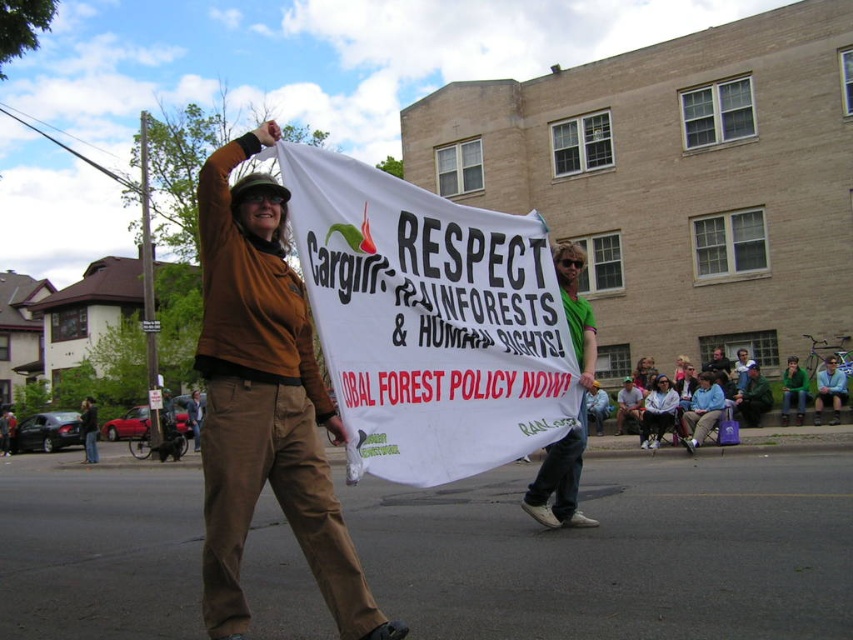
Can you confirm if white paper banner at center is positioned below green fabric shirt at center?

No, white paper banner at center is not below green fabric shirt at center.

Which of these two, white paper banner at center or green fabric shirt at center, stands taller?

With more height is green fabric shirt at center.

Who is more forward, (374, 378) or (590, 352)?

Point (374, 378) is in front.

Find the location of a particular element. The height and width of the screenshot is (640, 853). white paper banner at center is located at coordinates (428, 321).

Between brown fabric pants at center and blue denim jeans at lower right, which one appears on the left side from the viewer's perspective?

brown fabric pants at center

Does point (218, 346) come in front of point (816, 376)?

That is True.

Identify the location of brown fabric pants at center. (264, 401).

What do you see at coordinates (828, 388) in the screenshot? This screenshot has width=853, height=640. I see `blue denim jeans at lower right` at bounding box center [828, 388].

Is point (845, 374) positioned in front of point (807, 387)?

Yes.

Find the location of a particular element. The height and width of the screenshot is (640, 853). blue denim jeans at lower right is located at coordinates (828, 388).